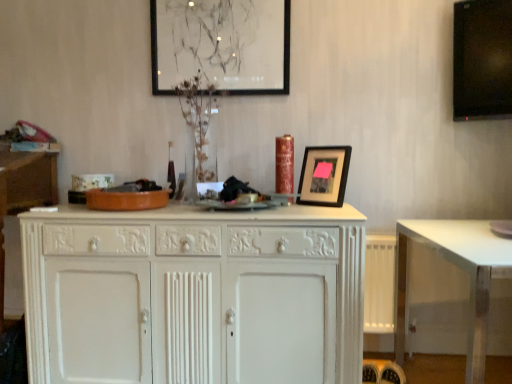
Question: Which is correct: black glossy monitor at upper right is inside black matte picture frame at upper center, the 2th picture frame in the back-to-front sequence, or outside of it?

Choices:
 (A) outside
 (B) inside

Answer: (A)

Question: From a real-world perspective, is black glossy monitor at upper right positioned above or below black matte picture frame at upper center, which is the 1th picture frame from front to back?

Choices:
 (A) above
 (B) below

Answer: (A)

Question: Estimate the real-world distances between objects in this image. Which object is farther from the white painted wood cabinet at center?

Choices:
 (A) black matte picture frame at upper center, which is counted as the 1th picture frame, starting from the bottom
 (B) white glossy table at lower right
 (C) white wood cabinet at left
 (D) black glossy monitor at upper right
 (E) clear glass vase at center

Answer: (D)

Question: Which is farther from the white wood cabinet at left?

Choices:
 (A) white glossy table at lower right
 (B) black matte picture frame at upper center, arranged as the second picture frame when ordered from the bottom
 (C) white painted wood cabinet at center
 (D) black glossy monitor at upper right
 (E) clear glass vase at center

Answer: (D)